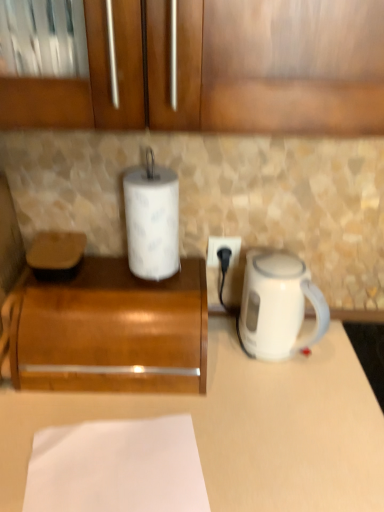
At what (x,y) coordinates should I click in order to perform the action: click on vacant area on top of white glossy electric kettle at right (from a real-world perspective). Please return your answer as a coordinate pair (x, y). Looking at the image, I should click on (279, 264).